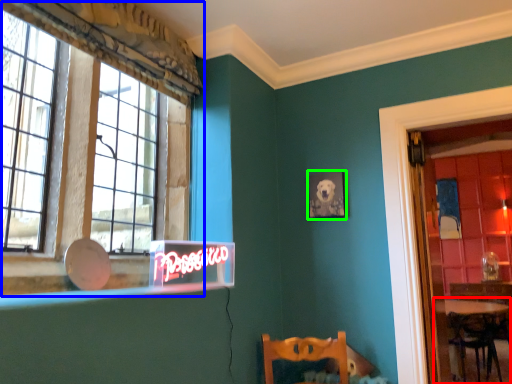
Question: Which object is the farthest from table (highlighted by a red box)? Choose among these: window (highlighted by a blue box) or picture frame (highlighted by a green box).

Choices:
 (A) window
 (B) picture frame

Answer: (A)